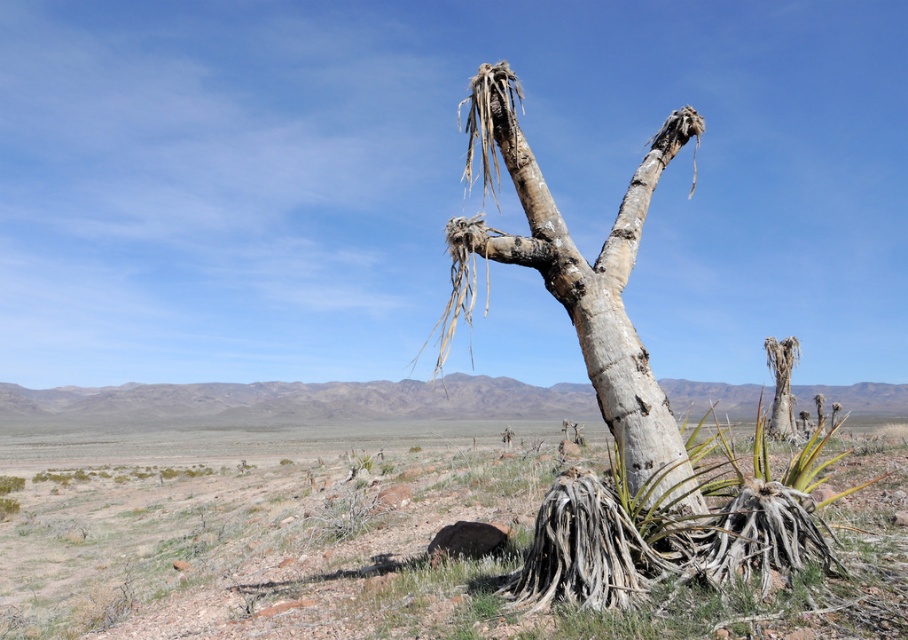
Question: In this image, where is desert soil at center located relative to gray bark tree at center?

Choices:
 (A) left
 (B) right

Answer: (A)

Question: Which point is closer to the camera taking this photo?

Choices:
 (A) (857, 444)
 (B) (664, 145)

Answer: (B)

Question: Which point is closer to the camera?

Choices:
 (A) desert soil at center
 (B) gray bark tree at center

Answer: (A)

Question: Can you confirm if desert soil at center is positioned above gray bark tree at center?

Choices:
 (A) no
 (B) yes

Answer: (A)

Question: Can you confirm if desert soil at center is thinner than gray bark tree at center?

Choices:
 (A) no
 (B) yes

Answer: (A)

Question: Which of the following is the farthest from the observer?

Choices:
 (A) gray bark tree at center
 (B) desert soil at center

Answer: (A)